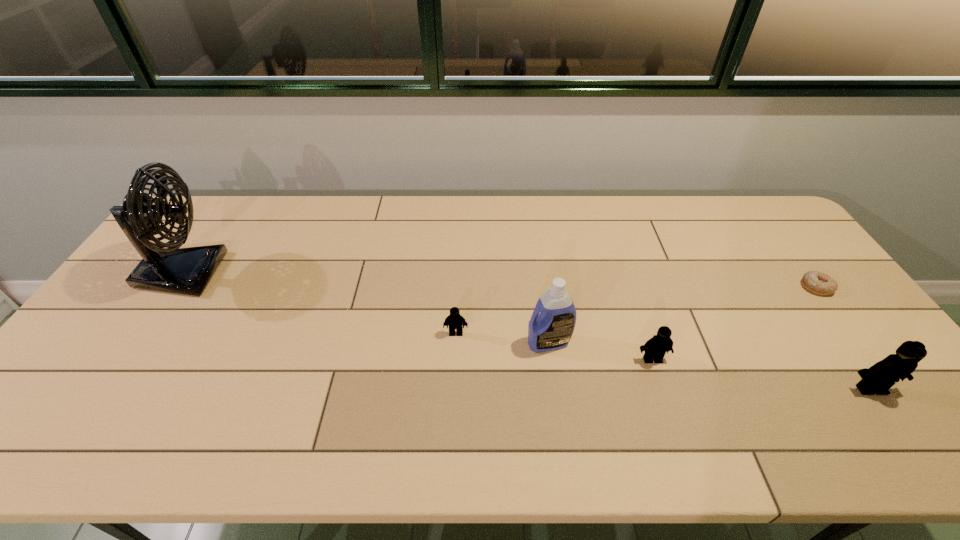
At what (x,y) coordinates should I click in order to perform the action: click on the shortest Lego. Please return your answer as a coordinate pair (x, y). The width and height of the screenshot is (960, 540). Looking at the image, I should click on (455, 321).

Find the location of `the leftmost Lego`. the leftmost Lego is located at coordinates (455, 321).

The width and height of the screenshot is (960, 540). In order to click on the second farthest Lego in this screenshot , I will do pos(655,348).

The image size is (960, 540). Identify the location of the fourth object from left to right. (655, 348).

Where is `the nearest object`? The image size is (960, 540). the nearest object is located at coordinates (878, 379).

Find the location of a particular element. Image resolution: width=960 pixels, height=540 pixels. the rightmost Lego is located at coordinates (878, 379).

Image resolution: width=960 pixels, height=540 pixels. What are the coordinates of `doughnut` in the screenshot? It's located at (816, 282).

Locate an element on the screen. fan is located at coordinates (172, 269).

Find the location of a particular element. the leftmost object is located at coordinates (172, 269).

Find the location of a particular element. The width and height of the screenshot is (960, 540). detergent is located at coordinates (552, 329).